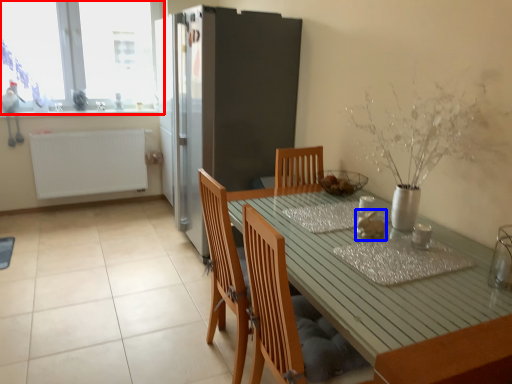
Question: Among these objects, which one is nearest to the camera, window (highlighted by a red box) or food (highlighted by a blue box)?

Choices:
 (A) window
 (B) food

Answer: (B)